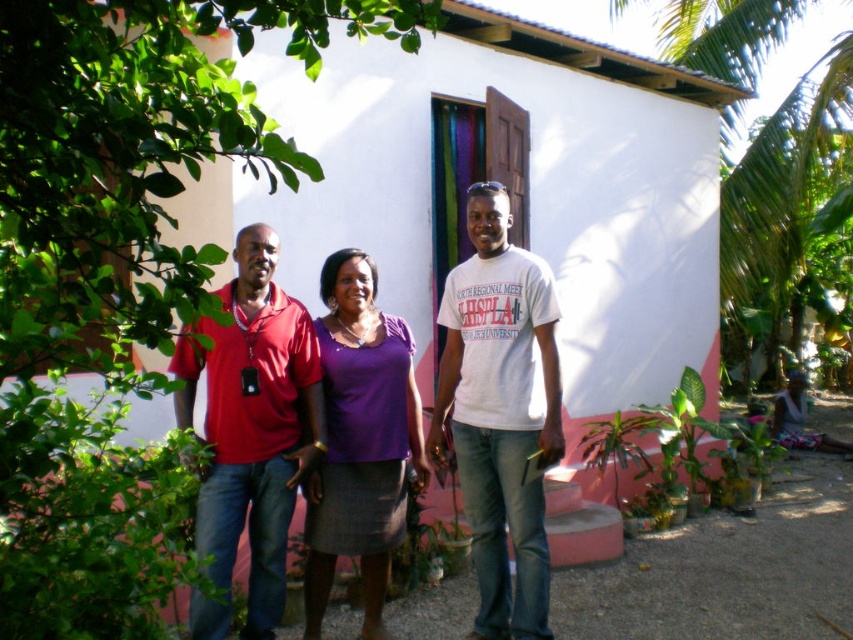
Can you confirm if matte red shirt at center is wider than white cotton t-shirt at center?

Correct, the width of matte red shirt at center exceeds that of white cotton t-shirt at center.

Does matte red shirt at center have a lesser height compared to white cotton t-shirt at center?

Yes, matte red shirt at center is shorter than white cotton t-shirt at center.

Image resolution: width=853 pixels, height=640 pixels. I want to click on matte red shirt at center, so pyautogui.click(x=437, y=426).

Does matte red shirt at left have a larger size compared to purple matte shirt at center?

Yes, matte red shirt at left is bigger than purple matte shirt at center.

Does matte red shirt at left have a lesser height compared to purple matte shirt at center?

Indeed, matte red shirt at left has a lesser height compared to purple matte shirt at center.

Which is in front, point (277, 525) or point (363, 449)?

Point (277, 525) is more forward.

Identify the location of matte red shirt at left. (251, 433).

Is matte red shirt at center closer to camera compared to purple matte shirt at center?

Yes, it is.

I want to click on matte red shirt at center, so click(437, 426).